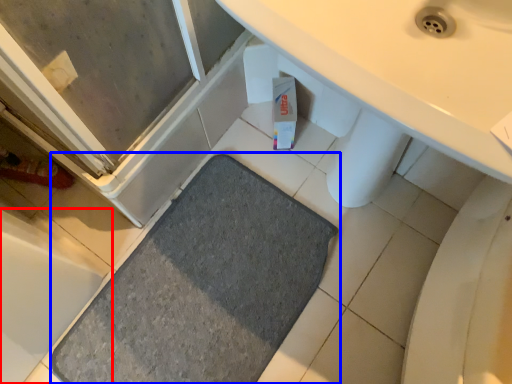
Question: Which object appears closest to the camera in this image, bath (highlighted by a red box) or bath mat (highlighted by a blue box)?

Choices:
 (A) bath
 (B) bath mat

Answer: (A)